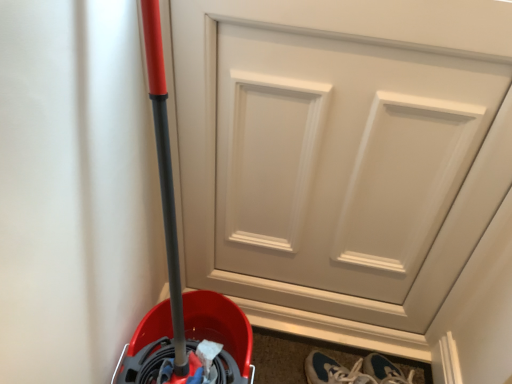
Where is `empty space that is ontop of white matte door at center (from a real-world perspective)`? empty space that is ontop of white matte door at center (from a real-world perspective) is located at coordinates (391, 15).